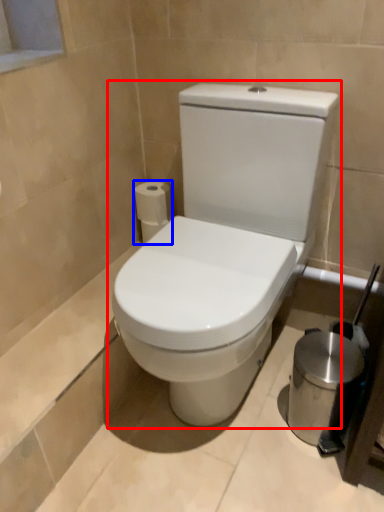
Question: Which object is further to the camera taking this photo, toilet (highlighted by a red box) or toilet paper (highlighted by a blue box)?

Choices:
 (A) toilet
 (B) toilet paper

Answer: (B)